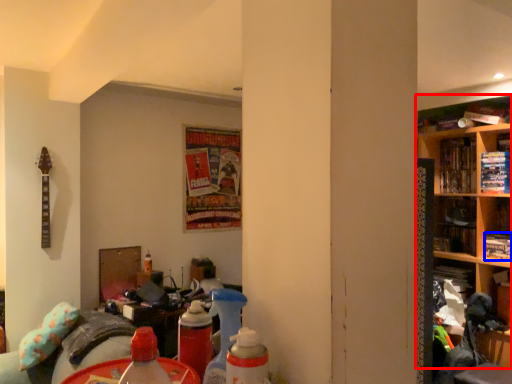
Question: Which of the following is the closest to the observer, shelf (highlighted by a red box) or book (highlighted by a blue box)?

Choices:
 (A) shelf
 (B) book

Answer: (A)